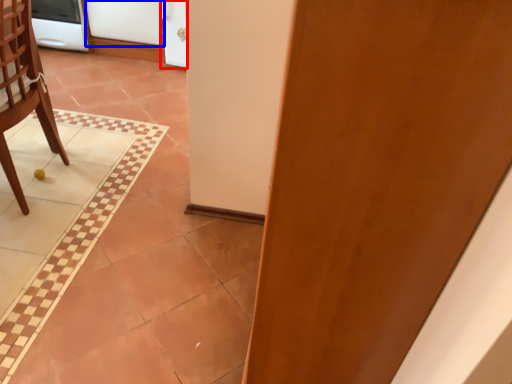
Question: Which of the following is the closest to the observer, screen door (highlighted by a red box) or screen door (highlighted by a blue box)?

Choices:
 (A) screen door
 (B) screen door

Answer: (A)